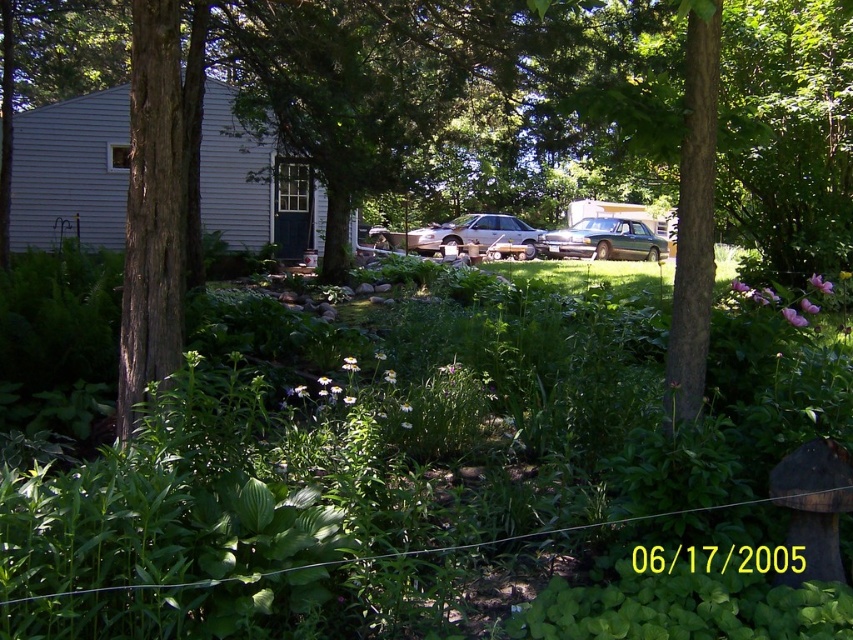
Question: From the image, what is the correct spatial relationship of brown rough tree at center in relation to green matte sedan at center?

Choices:
 (A) below
 (B) above

Answer: (B)

Question: Can you confirm if brown rough tree at center is positioned to the left of green matte sedan at center?

Choices:
 (A) yes
 (B) no

Answer: (A)

Question: Among these objects, which one is nearest to the camera?

Choices:
 (A) green matte sedan at center
 (B) gold metallic car at center

Answer: (B)

Question: Which of the following is the closest to the observer?

Choices:
 (A) green matte sedan at center
 (B) gold metallic car at center
 (C) green leafy plants at center

Answer: (C)

Question: Which point is farther to the camera?

Choices:
 (A) brown rough tree at center
 (B) green leafy plants at center
 (C) gold metallic car at center

Answer: (C)

Question: Can you confirm if green leafy plants at center is thinner than green matte sedan at center?

Choices:
 (A) no
 (B) yes

Answer: (A)